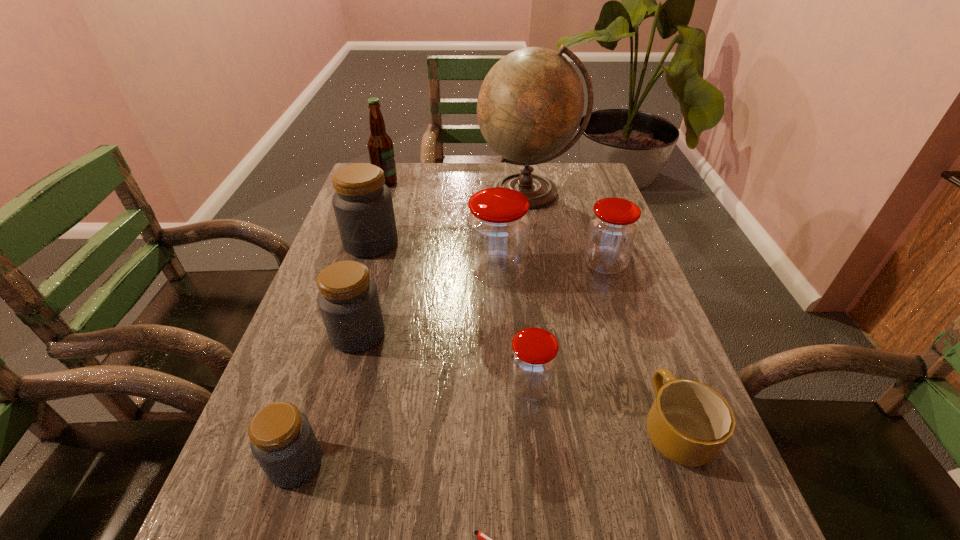
The width and height of the screenshot is (960, 540). I want to click on jar that is at the right edge, so click(613, 226).

The height and width of the screenshot is (540, 960). Find the location of `mug at the right edge`. mug at the right edge is located at coordinates (689, 423).

At what (x,y) coordinates should I click in order to perform the action: click on object present at the far left corner. Please return your answer as a coordinate pair (x, y). The height and width of the screenshot is (540, 960). Looking at the image, I should click on (380, 146).

I want to click on object that is positioned at the far right corner, so click(531, 102).

In the image, there is a desktop. Where is `free space at the far edge`? The width and height of the screenshot is (960, 540). free space at the far edge is located at coordinates (471, 186).

Where is `vacant area at the left edge`? The width and height of the screenshot is (960, 540). vacant area at the left edge is located at coordinates (319, 308).

Find the location of a particular element. vacant area at the right edge is located at coordinates (589, 211).

Locate an element on the screen. free space between the biggest red jar and the smallest gray jar is located at coordinates (396, 368).

The height and width of the screenshot is (540, 960). Find the location of `vacant area that lies between the second biggest red jar and the globe`. vacant area that lies between the second biggest red jar and the globe is located at coordinates (566, 228).

Identify the location of free space that is in between the tallest object and the beer bottle. (457, 187).